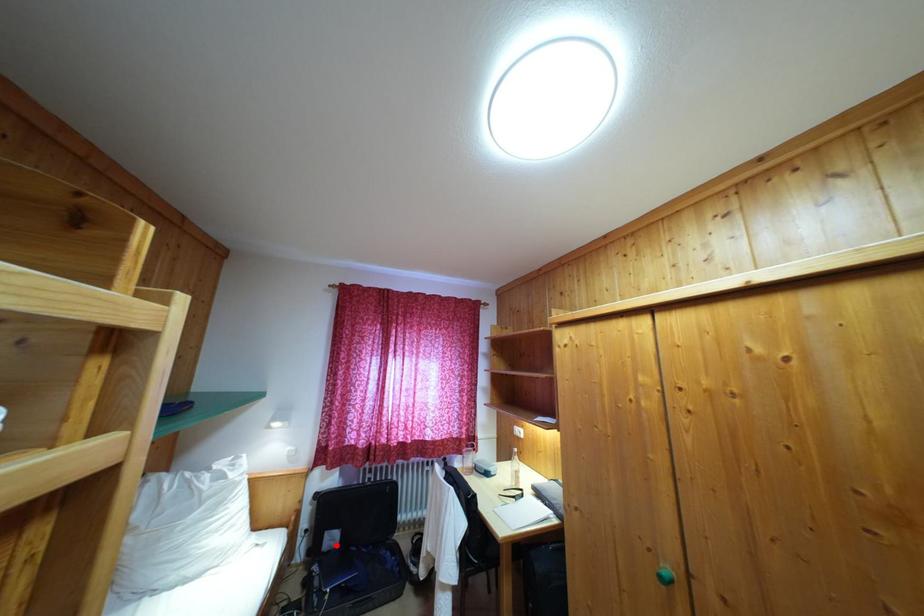
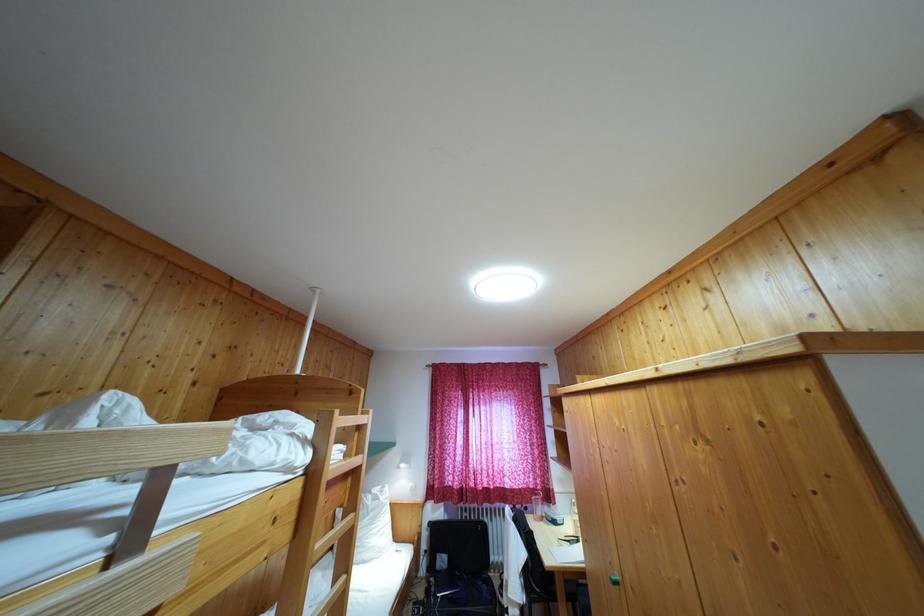
In the second image, find the point that corresponds to the highlighted location in the first image.

(445, 567)